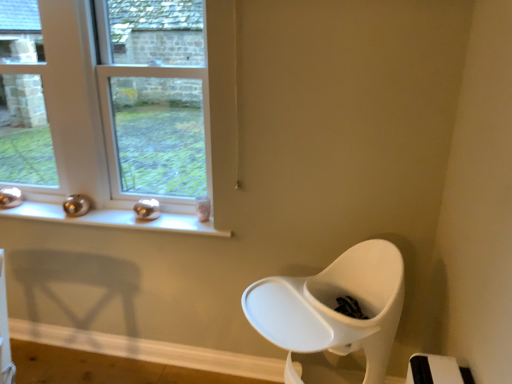
This screenshot has width=512, height=384. Identify the location of metallic silver window sill at upper left. coord(115,219).

What is the approximate width of clear glass window at upper left, which is the second window from left to right?

The width of clear glass window at upper left, which is the second window from left to right, is 3.41 inches.

What do you see at coordinates (23, 99) in the screenshot? I see `clear glass window at left, arranged as the 2th window when viewed from the right` at bounding box center [23, 99].

The image size is (512, 384). What are the coordinates of `metallic silver window sill at upper left` in the screenshot? It's located at point(115,219).

Is clear glass window at upper left, which is the second window from left to right, bigger than metallic silver window sill at upper left?

Yes.

Is point (179, 157) positioned after point (98, 217)?

Yes, point (179, 157) is behind point (98, 217).

Which object is positioned more to the left, clear glass window at upper left, positioned as the 1th window in right-to-left order, or metallic silver window sill at upper left?

Positioned to the left is metallic silver window sill at upper left.

Is clear glass window at upper left, positioned as the 1th window in right-to-left order, far away from metallic silver window sill at upper left?

That's not correct — clear glass window at upper left, positioned as the 1th window in right-to-left order, is a little close to metallic silver window sill at upper left.

In the scene shown: Considering the positions of objects metallic silver window sill at upper left and clear glass window at upper left, which is the second window from left to right, in the image provided, who is more to the left, metallic silver window sill at upper left or clear glass window at upper left, which is the second window from left to right,?

metallic silver window sill at upper left.

Can you confirm if metallic silver window sill at upper left is shorter than clear glass window at upper left, which is the second window from left to right?

Yes.

Is metallic silver window sill at upper left completely or partially outside of clear glass window at upper left, positioned as the 1th window in right-to-left order?

Yes, metallic silver window sill at upper left is not within clear glass window at upper left, positioned as the 1th window in right-to-left order.

From the image's perspective, which is above, clear glass window at left, the first window when ordered from left to right, or metallic silver window sill at upper left?

clear glass window at left, the first window when ordered from left to right, appears higher in the image.

Considering the sizes of clear glass window at left, the first window when ordered from left to right, and metallic silver window sill at upper left in the image, is clear glass window at left, the first window when ordered from left to right, bigger or smaller than metallic silver window sill at upper left?

Clearly, clear glass window at left, the first window when ordered from left to right, is larger in size than metallic silver window sill at upper left.

Is clear glass window at left, the first window when ordered from left to right, placed right next to metallic silver window sill at upper left?

No.

Is clear glass window at left, the first window when ordered from left to right, at the right side of metallic silver window sill at upper left?

No, clear glass window at left, the first window when ordered from left to right, is not to the right of metallic silver window sill at upper left.

Can you confirm if clear glass window at left, the first window when ordered from left to right, is bigger than clear glass window at upper left, positioned as the 1th window in right-to-left order?

No.

Which object is thinner, clear glass window at left, the first window when ordered from left to right, or clear glass window at upper left, which is the second window from left to right?

Thinner between the two is clear glass window at left, the first window when ordered from left to right.

From the image's perspective, is clear glass window at left, the first window when ordered from left to right, under clear glass window at upper left, positioned as the 1th window in right-to-left order?

No.

Is point (189, 1) behind point (47, 144)?

Yes, it is.

Is clear glass window at upper left, positioned as the 1th window in right-to-left order, facing away from clear glass window at left, arranged as the 2th window when viewed from the right?

No, clear glass window at left, arranged as the 2th window when viewed from the right, is not at the back of clear glass window at upper left, positioned as the 1th window in right-to-left order.

Considering the positions of objects clear glass window at upper left, which is the second window from left to right, and clear glass window at left, arranged as the 2th window when viewed from the right, in the image provided, who is more to the left, clear glass window at upper left, which is the second window from left to right, or clear glass window at left, arranged as the 2th window when viewed from the right,?

clear glass window at left, arranged as the 2th window when viewed from the right.

How far apart are clear glass window at upper left, which is the second window from left to right, and clear glass window at left, arranged as the 2th window when viewed from the right?

The distance of clear glass window at upper left, which is the second window from left to right, from clear glass window at left, arranged as the 2th window when viewed from the right, is 26.20 inches.

How different are the orientations of metallic silver window sill at upper left and clear glass window at left, arranged as the 2th window when viewed from the right, in degrees?

There is a 2.48-degree angle between the facing directions of metallic silver window sill at upper left and clear glass window at left, arranged as the 2th window when viewed from the right.

Image resolution: width=512 pixels, height=384 pixels. What are the coordinates of `window sill in front of the clear glass window at left, the first window when ordered from left to right` in the screenshot? It's located at (115, 219).

Is clear glass window at left, the first window when ordered from left to right, located within metallic silver window sill at upper left?

No, metallic silver window sill at upper left does not contain clear glass window at left, the first window when ordered from left to right.

From the image's perspective, is metallic silver window sill at upper left positioned above or below clear glass window at left, arranged as the 2th window when viewed from the right?

metallic silver window sill at upper left is situated lower than clear glass window at left, arranged as the 2th window when viewed from the right, in the image.

Where is `the 1st window positioned above the metallic silver window sill at upper left (from the image's perspective)`? the 1st window positioned above the metallic silver window sill at upper left (from the image's perspective) is located at coordinates (155, 98).

Image resolution: width=512 pixels, height=384 pixels. In order to click on window sill below the clear glass window at upper left, positioned as the 1th window in right-to-left order (from a real-world perspective) in this screenshot , I will do `click(115, 219)`.

Looking at the image, which one is located closer to clear glass window at left, arranged as the 2th window when viewed from the right, metallic silver window sill at upper left or clear glass window at upper left, which is the second window from left to right?

metallic silver window sill at upper left is positioned closer to the anchor clear glass window at left, arranged as the 2th window when viewed from the right.

Considering their positions, is metallic silver window sill at upper left positioned closer to clear glass window at upper left, positioned as the 1th window in right-to-left order, than clear glass window at left, the first window when ordered from left to right?

The object closer to clear glass window at upper left, positioned as the 1th window in right-to-left order, is metallic silver window sill at upper left.

Looking at the image, which one is located further to clear glass window at upper left, positioned as the 1th window in right-to-left order, clear glass window at left, arranged as the 2th window when viewed from the right, or metallic silver window sill at upper left?

clear glass window at left, arranged as the 2th window when viewed from the right, is positioned further to the anchor clear glass window at upper left, positioned as the 1th window in right-to-left order.

Based on their spatial positions, is clear glass window at upper left, positioned as the 1th window in right-to-left order, or metallic silver window sill at upper left closer to clear glass window at left, arranged as the 2th window when viewed from the right?

metallic silver window sill at upper left is closer to clear glass window at left, arranged as the 2th window when viewed from the right.

From the image, which object appears to be nearer to metallic silver window sill at upper left, clear glass window at left, arranged as the 2th window when viewed from the right, or clear glass window at upper left, positioned as the 1th window in right-to-left order?

Based on the image, clear glass window at upper left, positioned as the 1th window in right-to-left order, appears to be nearer to metallic silver window sill at upper left.

Estimate the real-world distances between objects in this image. Which object is closer to metallic silver window sill at upper left, clear glass window at upper left, which is the second window from left to right, or clear glass window at left, the first window when ordered from left to right?

clear glass window at upper left, which is the second window from left to right.

This screenshot has height=384, width=512. Identify the location of window sill located between clear glass window at left, the first window when ordered from left to right, and clear glass window at upper left, which is the second window from left to right, in the left-right direction. [115, 219].